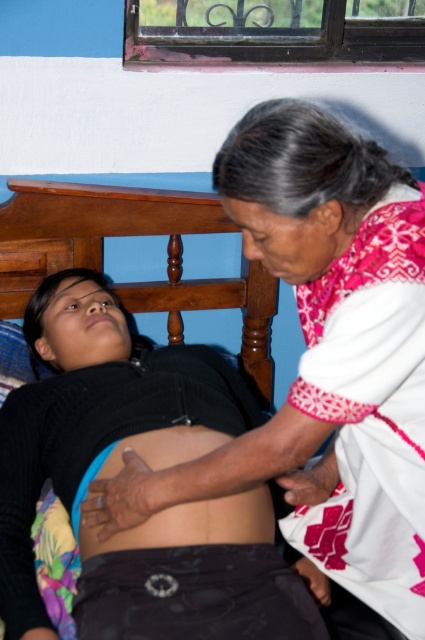
You are a healthcare professional entering a room and see the matte black shirt at center and the smooth skin at center. Which object is positioned higher up in the image?

The matte black shirt at center is taller than smooth skin at center, so the matte black shirt at center is positioned higher up in the image.

You are a healthcare professional assessing a patient in a home visit. You observe the matte black shirt at center and the smooth skin at center. Which object has a greater width?

The matte black shirt at center has a greater width than the smooth skin at center.

You are a medical professional assessing the scene. You need to determine which of the two points, point (x=374, y=538) or point (x=238, y=500), is closer to the viewer. Which one is it?

Point (x=374, y=538) is closer to the viewer than point (x=238, y=500).